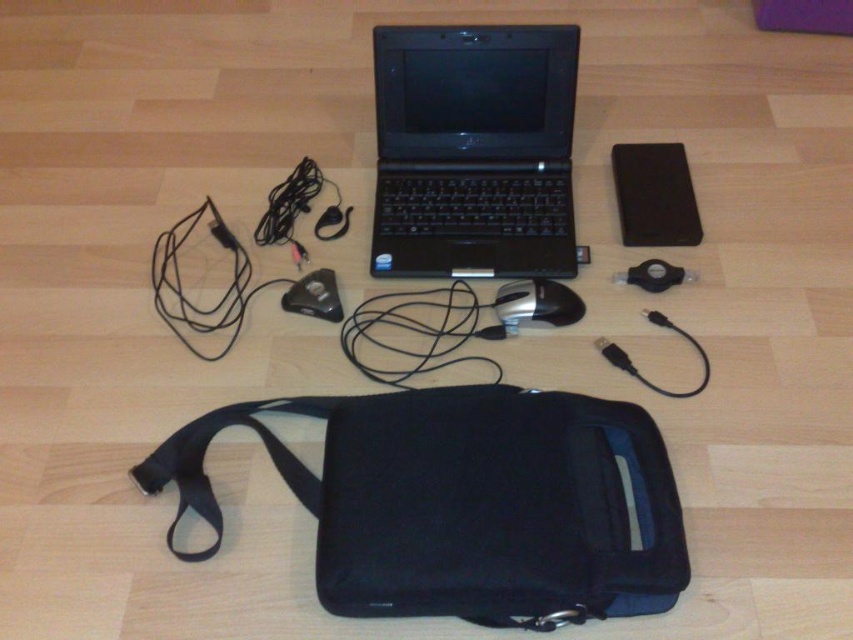
You are organizing a tech setup and need to store the black plastic laptop at center and the black fabric pouch at lower center. Which item can you place inside the other?

The black fabric pouch at lower center is larger in size than the black plastic laptop at center, so you can place the black plastic laptop at center inside the black fabric pouch at lower center.

You are organizing the cables and accessories around the black laptop. You need to place the black fabric strap at lower center and the black matte mouse at center in a specific order. According to their positions, which one is located to the left of the other?

The black fabric strap at lower center is positioned on the left side of black matte mouse at center.

You are organizing a tech setup and need to place the black fabric pouch at lower center closer to the Dell laptop. The minimum distance required between the pouch and the laptop is 12 inches. Is the current distance sufficient?

The current distance between the black fabric pouch at lower center and the Dell laptop is 32.42 inches, which is greater than the required 12 inches. Therefore, the current distance is sufficient.